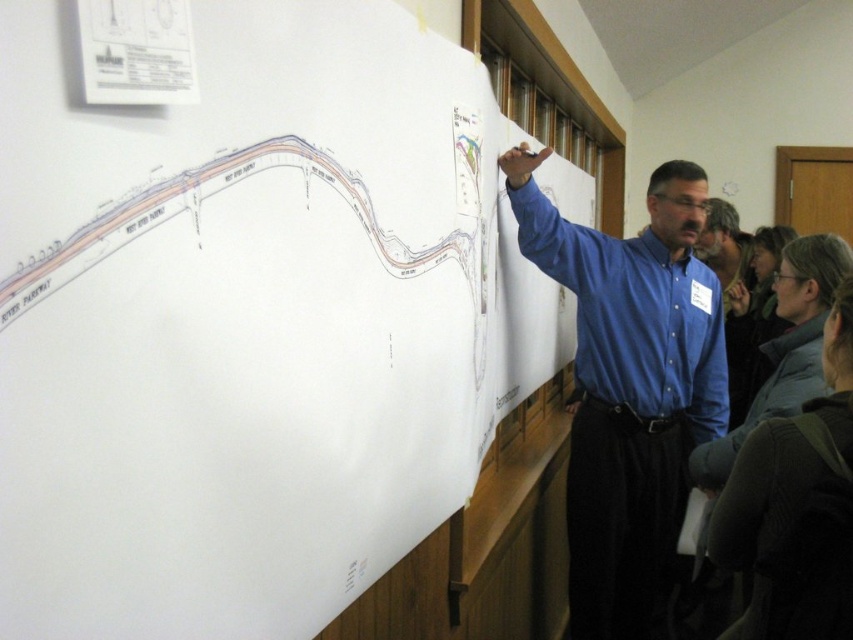
Does white paper at upper center come in front of blue shirt at upper right?

Yes, white paper at upper center is closer to the viewer.

Image resolution: width=853 pixels, height=640 pixels. What do you see at coordinates (248, 321) in the screenshot? I see `white paper at upper center` at bounding box center [248, 321].

The width and height of the screenshot is (853, 640). I want to click on white paper at upper center, so click(248, 321).